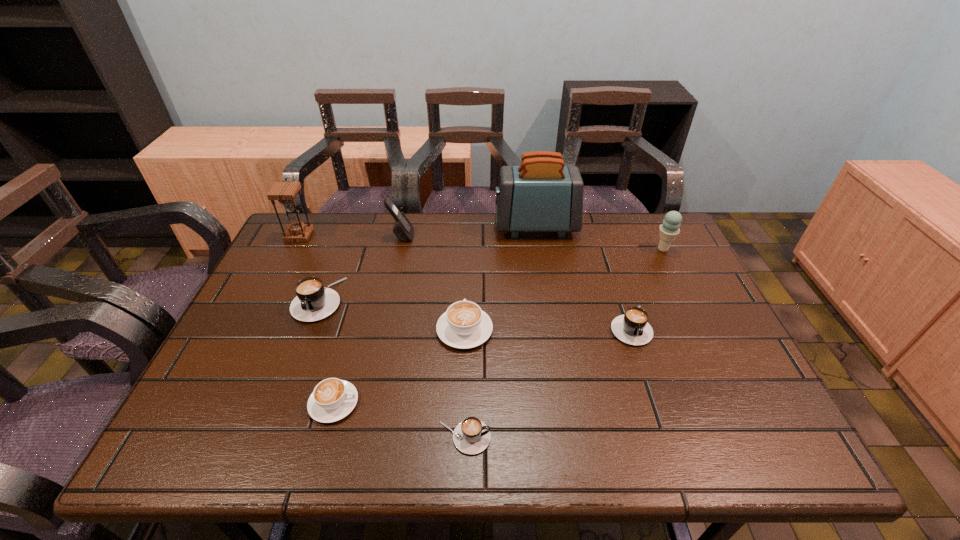
I want to click on the farther white cappuccino, so click(x=464, y=325).

I want to click on the rightmost cappuccino, so click(632, 328).

The height and width of the screenshot is (540, 960). I want to click on the second biggest black cappuccino, so click(x=632, y=328).

This screenshot has height=540, width=960. I want to click on the smaller white cappuccino, so click(333, 399).

The height and width of the screenshot is (540, 960). Identify the location of the left white cappuccino. (333, 399).

The height and width of the screenshot is (540, 960). I want to click on the smallest black cappuccino, so [471, 436].

You are a GUI agent. You are given a task and a screenshot of the screen. Output one action in this format:
    pyautogui.click(x=<x>, y=<y>)
    Task: Click on the nearest black cappuccino
    The image size is (960, 540).
    Given the screenshot: What is the action you would take?
    pyautogui.click(x=471, y=436)

At what (x,y) coordinates should I click in order to perform the action: click on free region located on the front-facing side of the seventh object from left to right. Please return your answer as a coordinate pair (x, y). Image resolution: width=960 pixels, height=540 pixels. Looking at the image, I should click on (465, 226).

Where is `vacant space located 0.060m on the front-facing side of the seventh object from left to right`? Image resolution: width=960 pixels, height=540 pixels. vacant space located 0.060m on the front-facing side of the seventh object from left to right is located at coordinates (477, 226).

Find the location of a particular element. The width and height of the screenshot is (960, 540). free space located on the front-facing side of the seventh object from left to right is located at coordinates (477, 226).